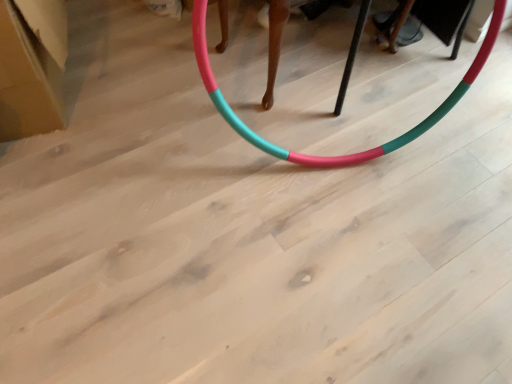
This screenshot has width=512, height=384. What are the coordinates of `free space to the back side of white cardboard box at upper left` in the screenshot? It's located at (113, 24).